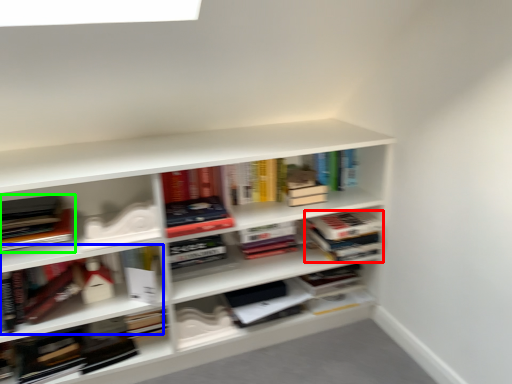
Question: Considering the real-world distances, which object is farthest from book (highlighted by a red box)? book (highlighted by a blue box) or book (highlighted by a green box)?

Choices:
 (A) book
 (B) book

Answer: (B)